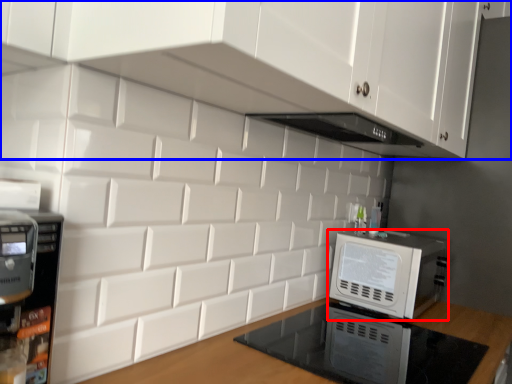
Question: Which point is closer to the camera, home appliance (highlighted by a red box) or cabinetry (highlighted by a blue box)?

Choices:
 (A) home appliance
 (B) cabinetry

Answer: (B)